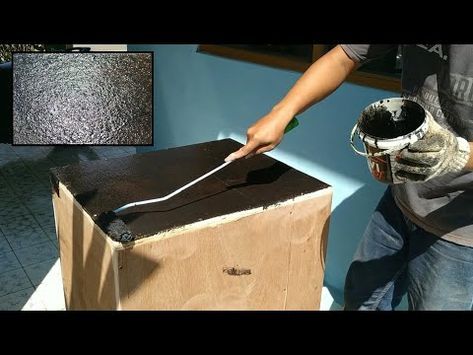
Where is `screwholes`? screwholes is located at coordinates click(x=119, y=267), click(x=290, y=211), click(x=284, y=289).